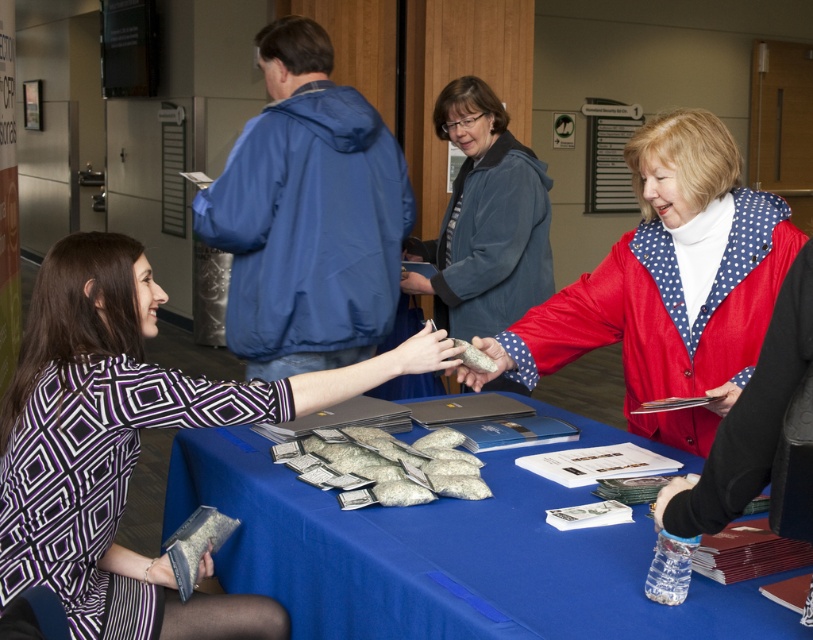
Question: Does matte plastic hand at center have a lesser width compared to matte black phone at center?

Choices:
 (A) no
 (B) yes

Answer: (A)

Question: Among these points, which one is farthest from the camera?

Choices:
 (A) (425, 292)
 (B) (467, 380)
 (C) (640, 150)

Answer: (A)

Question: Which is farther from the blue fabric tablecloth at center?

Choices:
 (A) matte gray rock at center
 (B) matte blue jacket at center
 (C) geometric-patterned blouse at center

Answer: (B)

Question: Is matte plastic hand at center to the left of matte gray rock at center from the viewer's perspective?

Choices:
 (A) yes
 (B) no

Answer: (A)

Question: Is blue fabric tablecloth at center smaller than matte plastic hand at center?

Choices:
 (A) no
 (B) yes

Answer: (A)

Question: Which object appears closest to the camera in this image?

Choices:
 (A) matte black phone at center
 (B) geometric-patterned blouse at center
 (C) matte plastic hand at center
 (D) clear plastic water bottle at lower right

Answer: (D)